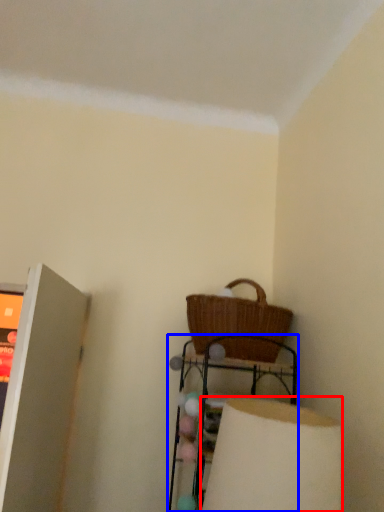
Question: Which object is closer to the camera taking this photo, lamp (highlighted by a red box) or furniture (highlighted by a blue box)?

Choices:
 (A) lamp
 (B) furniture

Answer: (A)